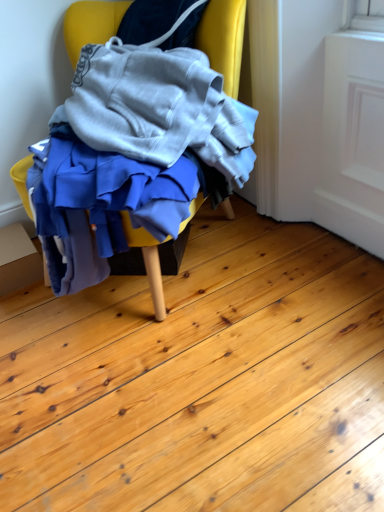
Locate an element on the screen. This screenshot has height=512, width=384. soft yellow chair at center is located at coordinates (224, 39).

This screenshot has height=512, width=384. What do you see at coordinates (224, 39) in the screenshot? I see `soft yellow chair at center` at bounding box center [224, 39].

The width and height of the screenshot is (384, 512). Identify the location of soft yellow chair at center. (224, 39).